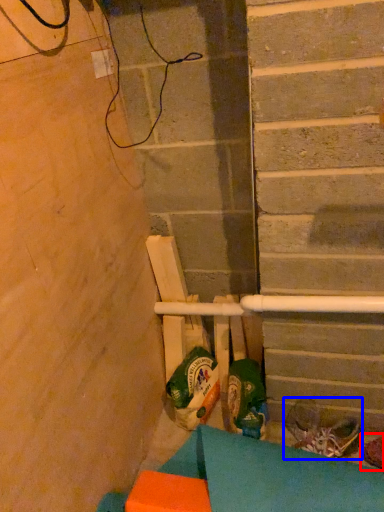
Question: Among these objects, which one is farthest to the camera, footwear (highlighted by a red box) or footwear (highlighted by a blue box)?

Choices:
 (A) footwear
 (B) footwear

Answer: (B)